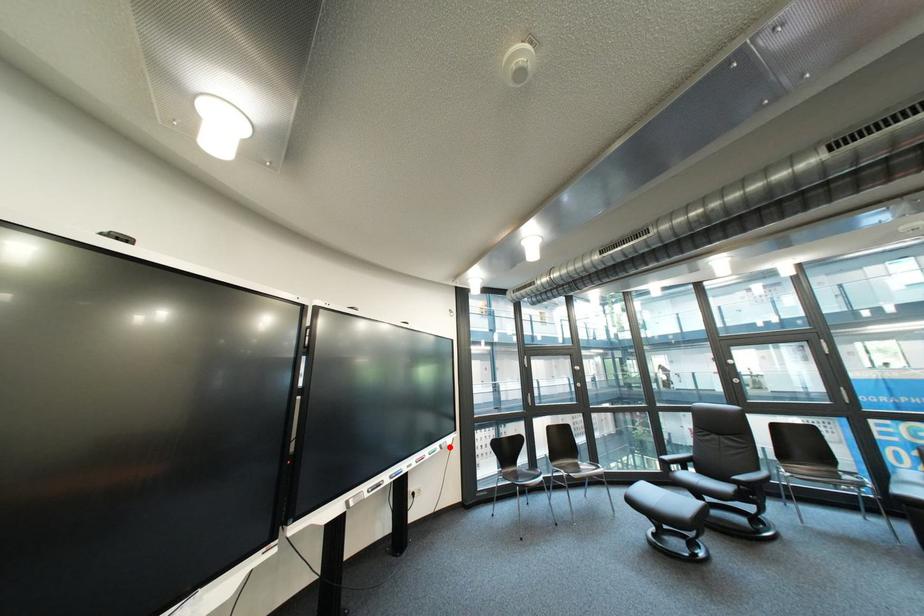
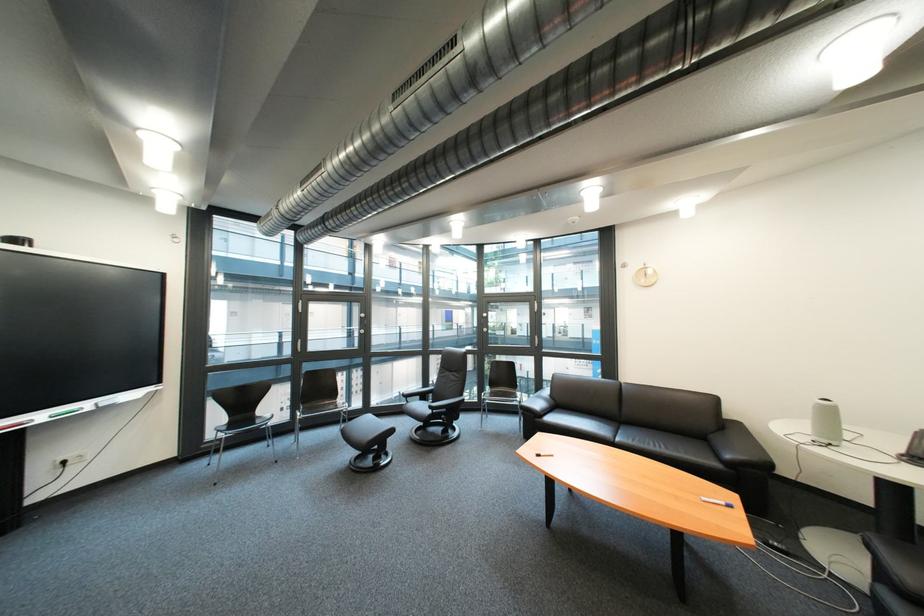
Question: I am providing you with two images of the same scene from different viewpoints. Image1 has a red point marked. In image2, the corresponding 3D location appears at what relative position? Reply with the corresponding letter.

Choices:
 (A) Closer
 (B) Farther

Answer: (A)